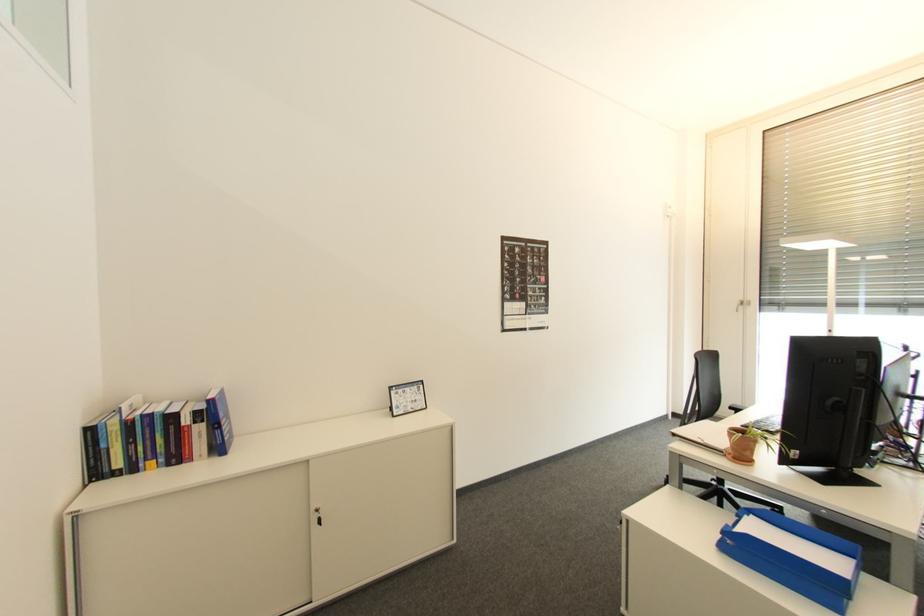
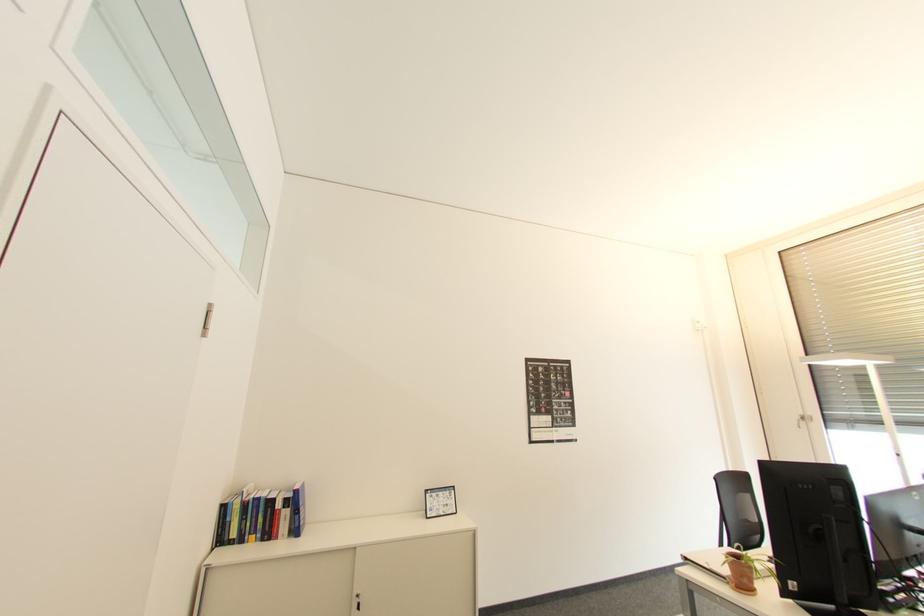
Question: How did the camera likely rotate?

Choices:
 (A) Left
 (B) Right
 (C) Up
 (D) Down

Answer: (C)